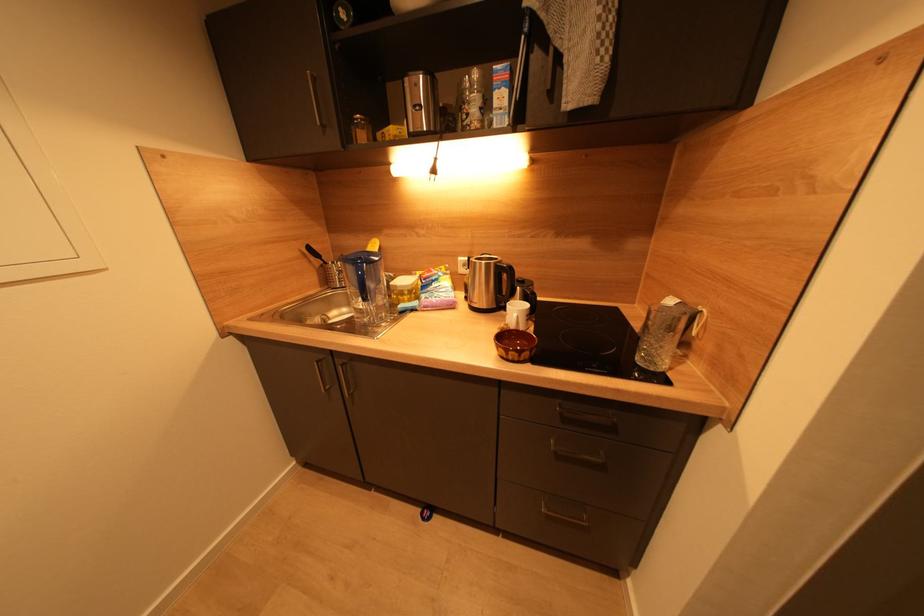
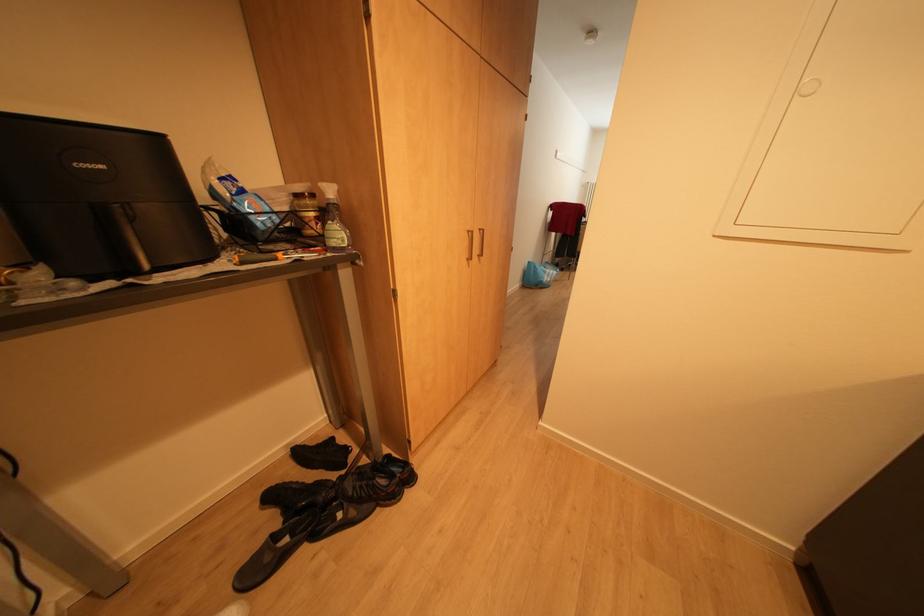
First-person continuous shooting, in which direction is the camera rotating?

The rotation direction of the camera is left-down.